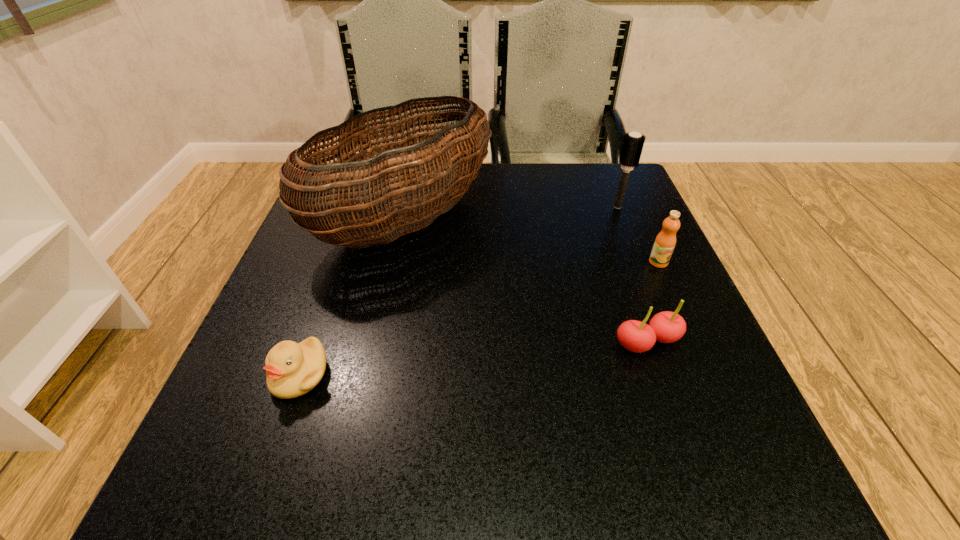
The image size is (960, 540). In order to click on vacant area at the left edge in this screenshot , I will do (x=342, y=299).

In the image, there is a desktop. What are the coordinates of `vacant space at the right edge` in the screenshot? It's located at (612, 329).

Find the location of a particular element. The width and height of the screenshot is (960, 540). vacant space at the far right corner of the desktop is located at coordinates (612, 179).

What are the coordinates of `empty space between the hairbrush and the basket` in the screenshot? It's located at (512, 213).

Locate an element on the screen. vacant space in between the cherry and the orange juice is located at coordinates (653, 302).

Where is `empty location between the second tallest object and the basket`? empty location between the second tallest object and the basket is located at coordinates (512, 213).

Identify the location of free space that is in between the basket and the cherry. This screenshot has height=540, width=960. (526, 281).

Where is `free space between the duckling and the basket`? free space between the duckling and the basket is located at coordinates (352, 298).

Where is `free space between the basket and the orange juice`? The width and height of the screenshot is (960, 540). free space between the basket and the orange juice is located at coordinates (532, 241).

Identify the location of free point between the third tallest object and the tallest object. (532, 241).